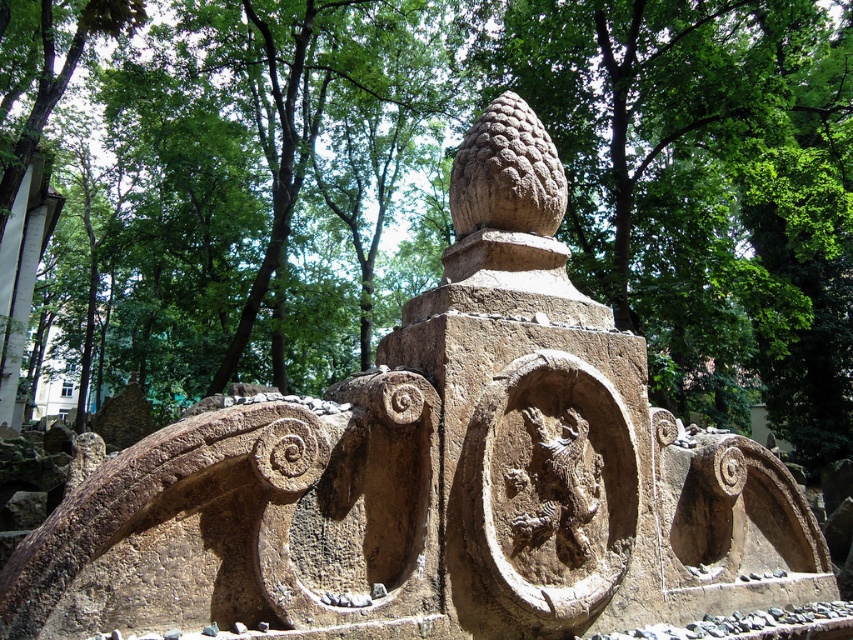
You are standing in front of the stone monument. You notice two points marked on the monument. The first point is at coordinates point (697, 192) and the second is at point (537, 486). If you want to touch both points starting from the one closer to you, which point should you touch first?

You should touch point (697, 192) first because it is closer to you than point (537, 486).

You are an archaeologist examining the brown stone tree at center and the rough stone dragon at center on an ancient monument. Which object appears closer to you on the monument?

The brown stone tree at center is closer to you than the rough stone dragon at center because it is further to the viewer.

From the picture: You are standing at the camera position and want to reach the point marked as point (15, 26). If your walking speed is 3 feet per second, how many seconds will it take you to reach the point?

The distance between point (15, 26) and the camera is 50.72 feet. At a walking speed of 3 feet per second, it will take 50.72 divided by 3, which is approximately 16.9 seconds to reach the point.